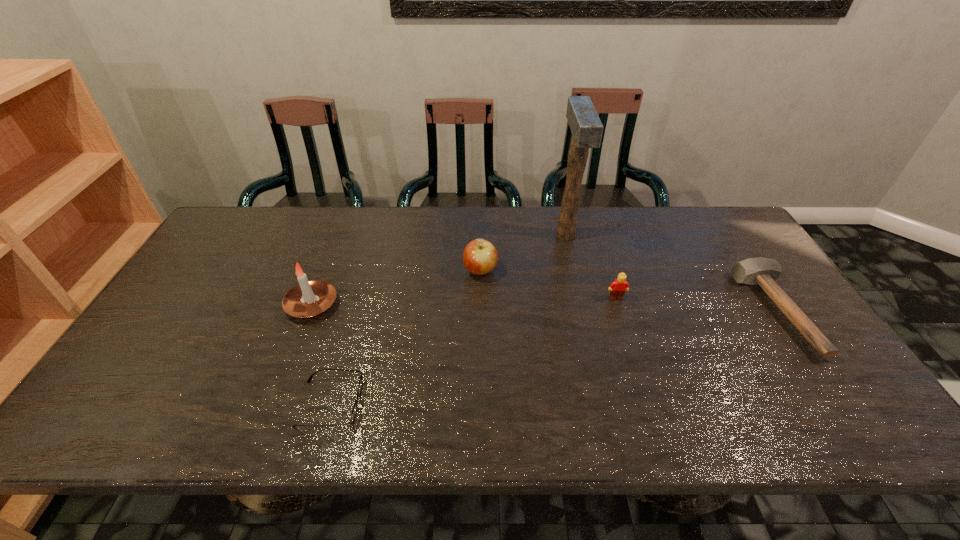
Locate an element on the screen. free space located on the back of the candle is located at coordinates click(337, 240).

Identify the location of blank area located 0.320m on the right of the third object from left to right. (604, 271).

Find the location of a particular element. vacant space located 0.380m on the face of the Lego is located at coordinates (657, 426).

Locate an element on the screen. vacant area situated 0.300m on the back of the right mallet is located at coordinates (709, 213).

This screenshot has height=540, width=960. I want to click on free space located on the front-facing side of the shortest object, so [x=444, y=404].

This screenshot has height=540, width=960. I want to click on object situated at the far edge, so tap(584, 122).

This screenshot has height=540, width=960. I want to click on object that is at the near edge, so click(354, 411).

Where is `object situated at the right edge`? This screenshot has height=540, width=960. object situated at the right edge is located at coordinates (763, 271).

Identify the location of free space at the far edge of the desktop. (359, 226).

Locate an element on the screen. This screenshot has height=540, width=960. free region at the near edge of the desktop is located at coordinates point(399,408).